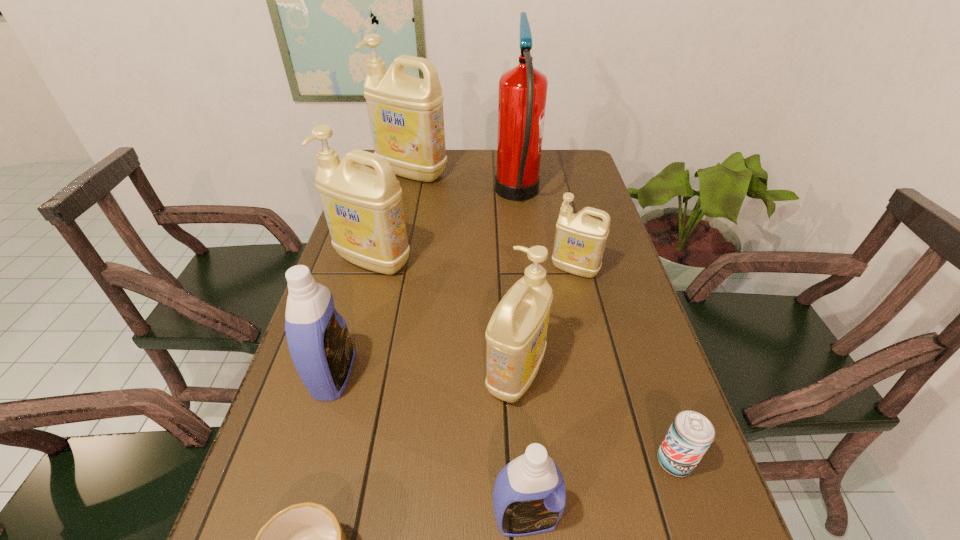
The height and width of the screenshot is (540, 960). I want to click on fire extinguisher, so click(522, 95).

Identify the location of the eighth shortest object. The width and height of the screenshot is (960, 540). (406, 116).

Locate an element on the screen. This screenshot has width=960, height=540. the farthest detergent is located at coordinates (406, 116).

Locate an element on the screen. the second tallest detergent is located at coordinates (363, 207).

The height and width of the screenshot is (540, 960). Identify the location of the third smallest beige detergent. (363, 207).

Where is `the second smallest beige detergent`? the second smallest beige detergent is located at coordinates (516, 334).

This screenshot has height=540, width=960. In order to click on the second beige detergent from right to left in this screenshot , I will do `click(516, 334)`.

Locate an element on the screen. Image resolution: width=960 pixels, height=540 pixels. the bigger blue detergent is located at coordinates [317, 335].

You are a GUI agent. You are given a task and a screenshot of the screen. Output one action in this format:
    pyautogui.click(x=<x>, y=<y>)
    Task: Click on the left blue detergent
    
    Given the screenshot: What is the action you would take?
    pyautogui.click(x=317, y=335)

At what (x,y) coordinates should I click in order to perform the action: click on the smallest beige detergent. Please return your answer as a coordinate pair (x, y). The height and width of the screenshot is (540, 960). Looking at the image, I should click on (580, 240).